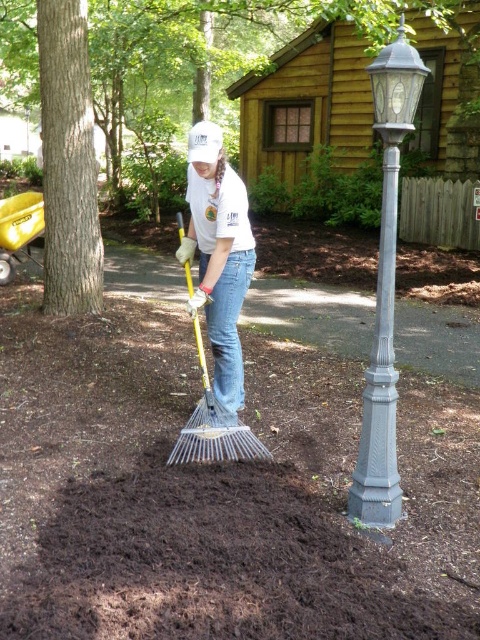
You are a visitor in this garden and want to take a photo of the gray cast iron lamp post at right and the gray cast iron pole at right. Which one should you focus on if you want to capture the taller object in your shot?

The gray cast iron pole at right is taller than the gray cast iron lamp post at right, so you should focus on the gray cast iron pole at right to capture the taller object in your shot.